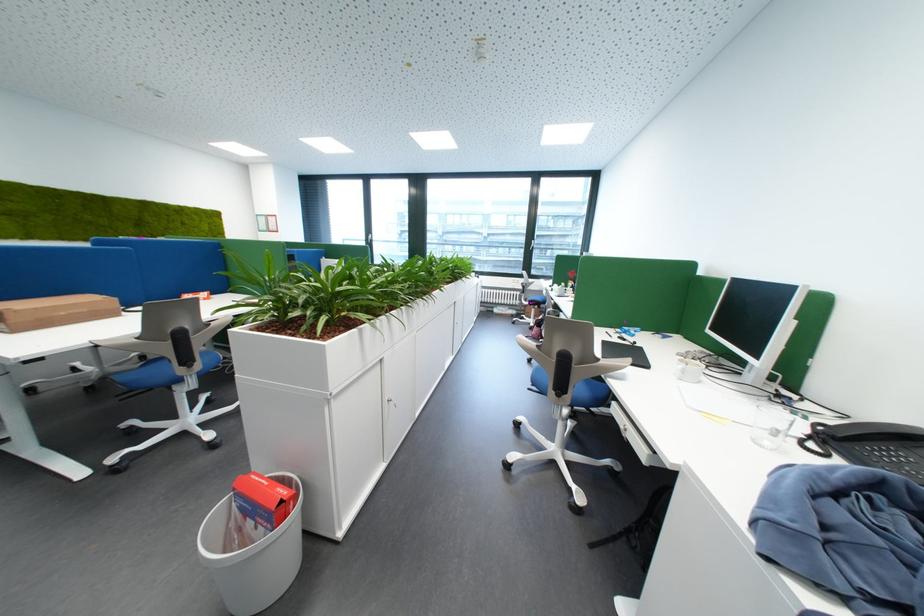
Identify the location of blue chair sitting surface. This screenshot has width=924, height=616. (141, 378).